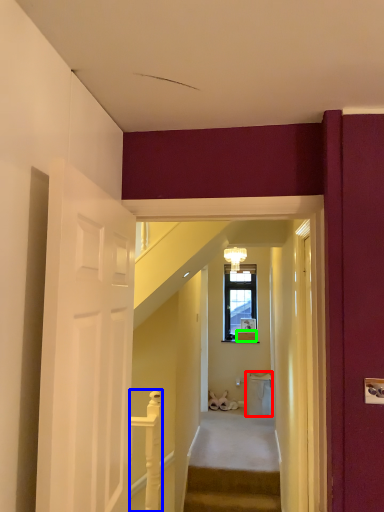
Question: Estimate the real-world distances between objects in this image. Which object is closer to trash bin/can (highlighted by a red box), balustrade (highlighted by a blue box) or box (highlighted by a green box)?

Choices:
 (A) balustrade
 (B) box

Answer: (B)